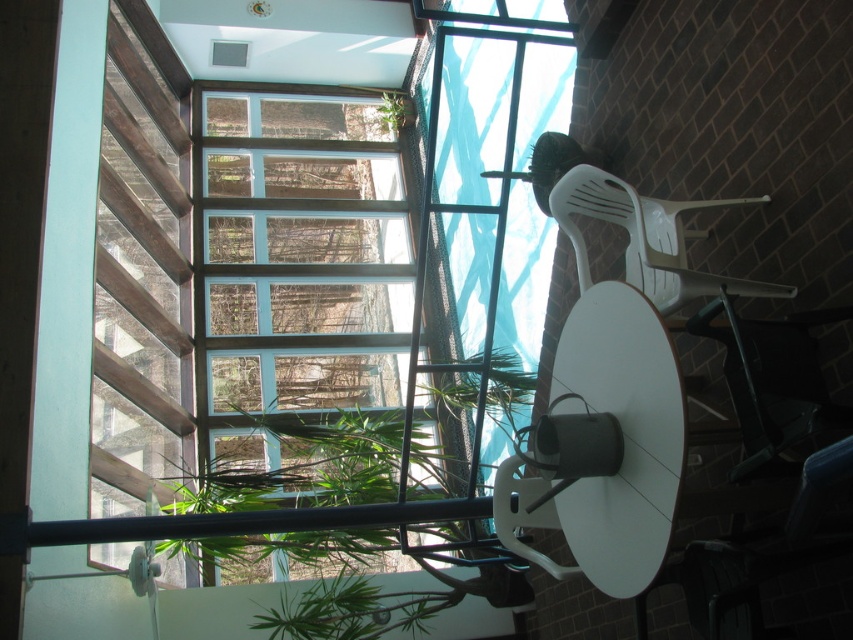
Who is taller, clear glass window at center or green leafy plant at upper center?

clear glass window at center is taller.

Does clear glass window at center have a lesser height compared to green leafy plant at upper center?

In fact, clear glass window at center may be taller than green leafy plant at upper center.

The width and height of the screenshot is (853, 640). In order to click on clear glass window at center in this screenshot , I will do `click(296, 260)`.

Is point (149, 182) positioned after point (384, 113)?

No, it is not.

Based on the photo, between wooden slats at left and green leafy plant at upper center, which one has more height?

With more height is wooden slats at left.

Is point (155, 72) closer to camera compared to point (384, 96)?

Yes, point (155, 72) is closer to viewer.

Locate an element on the screen. The image size is (853, 640). wooden slats at left is located at coordinates (140, 275).

Between clear glass window at center and wooden slats at left, which one appears on the right side from the viewer's perspective?

From the viewer's perspective, clear glass window at center appears more on the right side.

Does clear glass window at center have a smaller size compared to wooden slats at left?

Incorrect, clear glass window at center is not smaller in size than wooden slats at left.

Locate an element on the screen. The width and height of the screenshot is (853, 640). clear glass window at center is located at coordinates (296, 260).